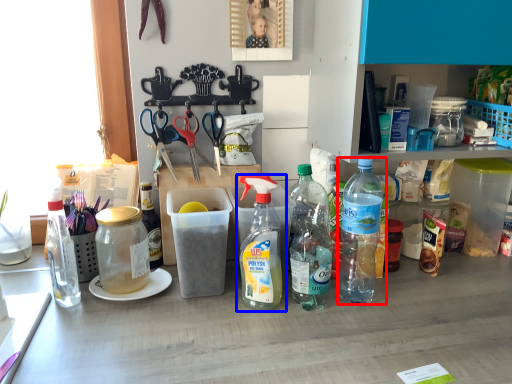
Question: Which of the following is the closest to the observer, bottle (highlighted by a red box) or bottle (highlighted by a blue box)?

Choices:
 (A) bottle
 (B) bottle

Answer: (B)